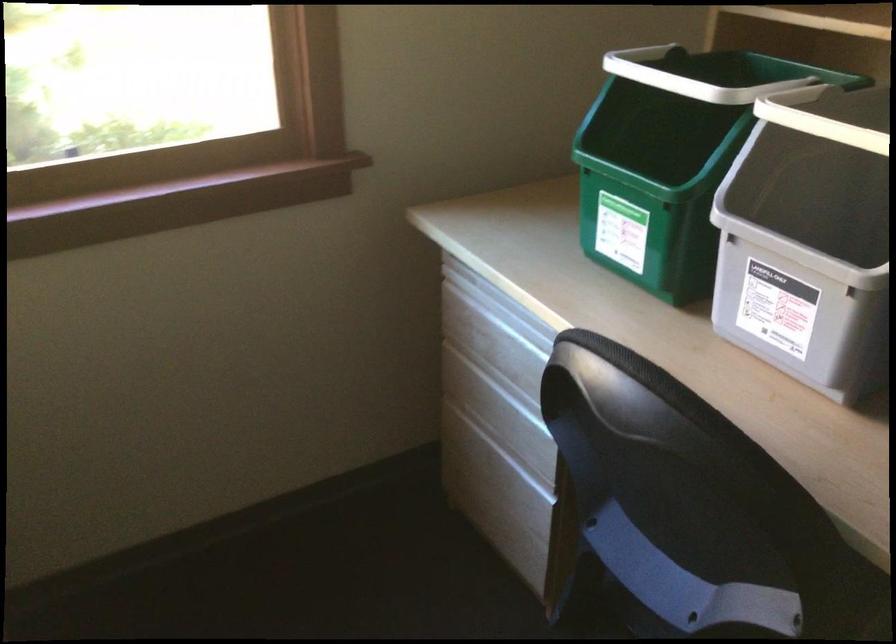
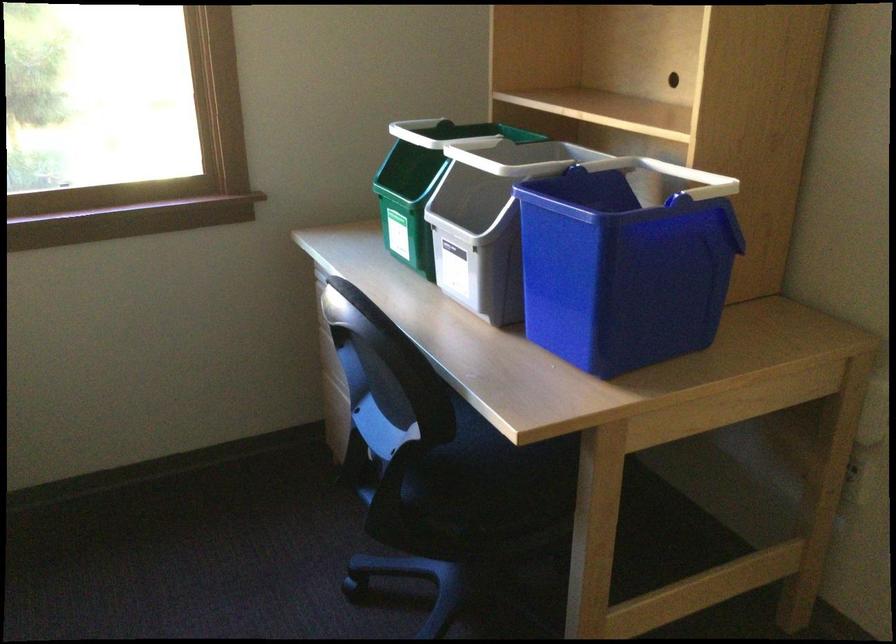
Where in the second image is the point corresponding to point 782,184 from the first image?

(479, 201)